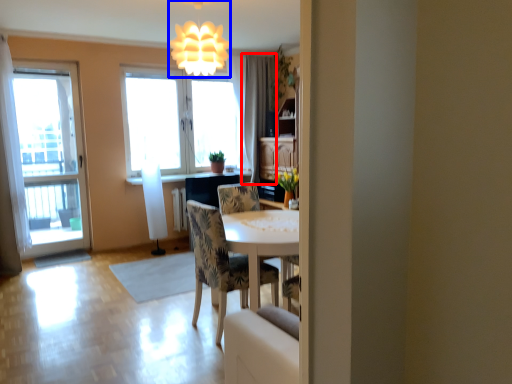
Question: Which object is further to the camera taking this photo, curtain (highlighted by a red box) or fixture (highlighted by a blue box)?

Choices:
 (A) curtain
 (B) fixture

Answer: (A)